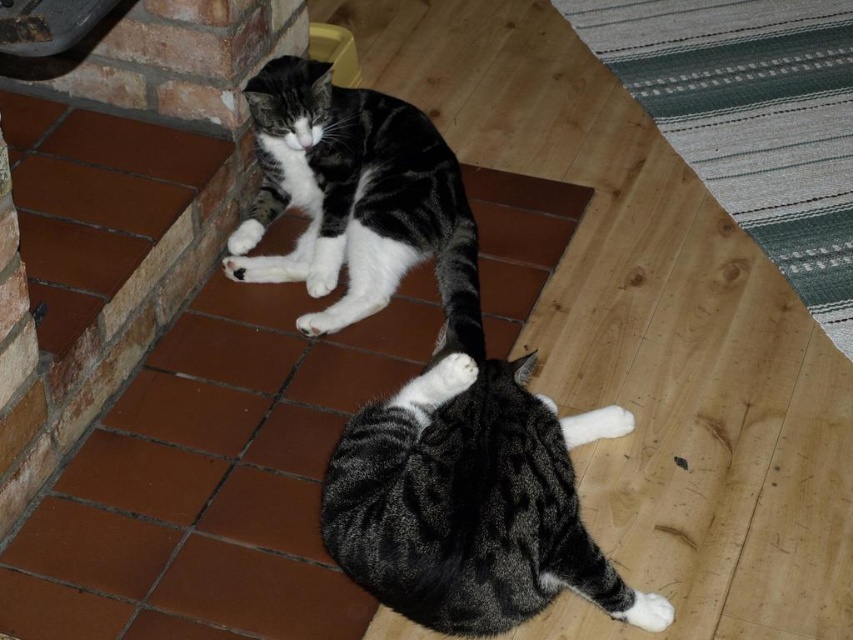
Based on the photo, you are a photographer trying to capture both the soft fur cat at lower right and the white fur at lower center in a single shot. Based on their positions, which cat is closer to the bottom edge of the photo?

The soft fur cat at lower right is located below white fur at lower center, so it is closer to the bottom edge of the photo.

You are a photographer trying to capture both the soft fur cat at lower right and the white fur paw at lower center in a single shot. Based on their positions, which cat is closer to the camera?

The soft fur cat at lower right is located below the white fur paw at lower center, so the white fur paw at lower center is closer to the camera.